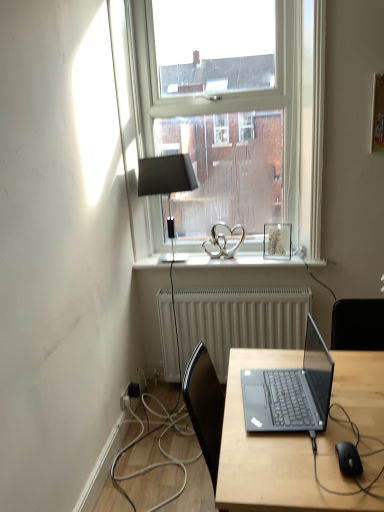
Identify the location of vacant space that's between black matte computer mouse at lower right and sleek black laptop at center. (319, 439).